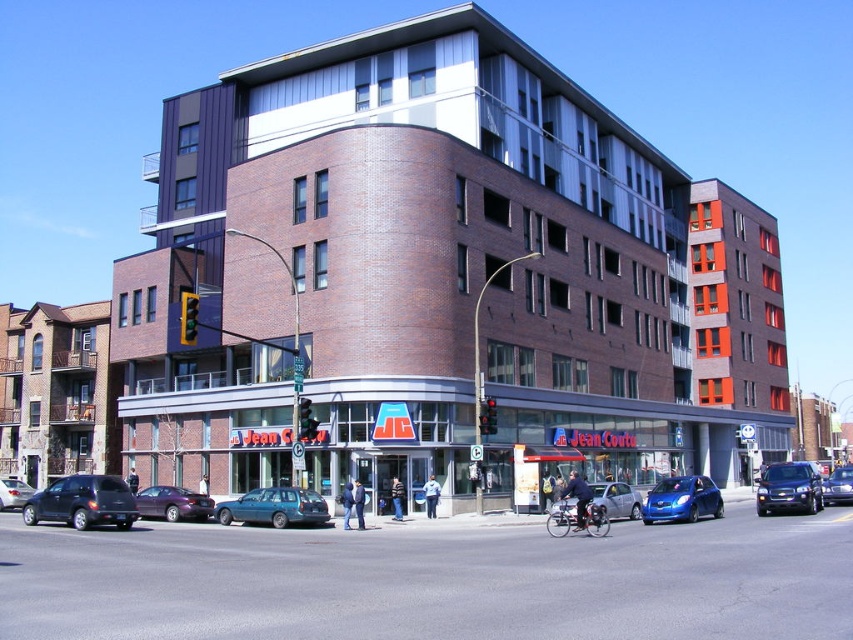
You are standing at the entrance of the Jean Coutu pharmacy on the ground floor of the building. You see two points marked on the building facade. According to their positions, which point is closer to you, point (825, 483) or point (16, 506)?

Point (825, 483) is in front of point (16, 506), so it is closer to you.

You are a delivery driver who needs to park your truck between the shiny blue sedan at center and the matte black sedan at center. The truck requires a space of at least 6 meters in length. Can you determine if there is enough space between them?

The shiny blue sedan at center is bigger than the matte black sedan at center, but the exact distance between them isn